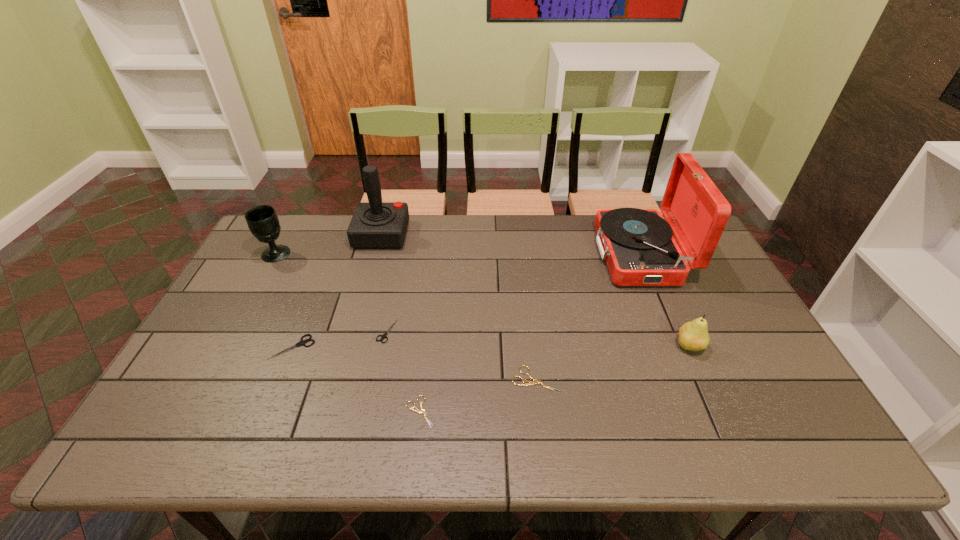
Locate an element on the screen. free space located 0.340m on the left of the bigger beige shears is located at coordinates (375, 380).

At what (x,y) coordinates should I click in order to perform the action: click on free space located on the front of the right black shears. Please return your answer as a coordinate pair (x, y). The width and height of the screenshot is (960, 540). Looking at the image, I should click on tap(372, 402).

The height and width of the screenshot is (540, 960). I want to click on vacant position located 0.130m on the left of the nearer beige shears, so click(349, 411).

You are a GUI agent. You are given a task and a screenshot of the screen. Output one action in this format:
    pyautogui.click(x=<x>, y=<y>)
    Task: Click on the phonograph_record positioned at the far edge
    This screenshot has width=960, height=540.
    Given the screenshot: What is the action you would take?
    pyautogui.click(x=638, y=246)

The height and width of the screenshot is (540, 960). I want to click on joystick that is positioned at the far edge, so click(x=375, y=224).

Identify the location of chalice present at the far edge. The width and height of the screenshot is (960, 540). (262, 220).

I want to click on object that is at the near edge, so click(417, 410).

Find the location of a particular element. Image resolution: width=960 pixels, height=540 pixels. object situated at the left edge is located at coordinates (262, 220).

This screenshot has width=960, height=540. In order to click on object present at the right edge in this screenshot , I will do [x=638, y=246].

The image size is (960, 540). In order to click on object that is positioned at the far left corner in this screenshot , I will do `click(262, 220)`.